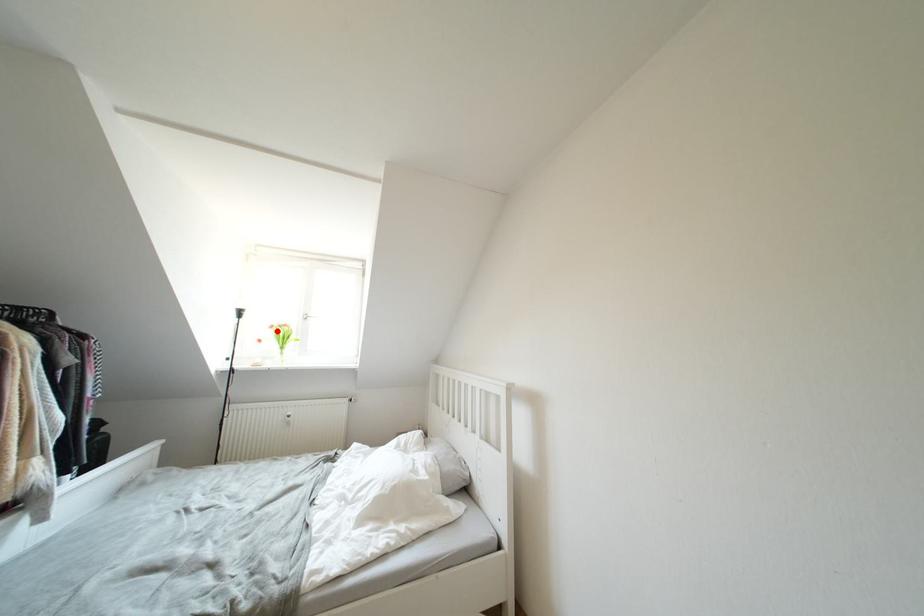
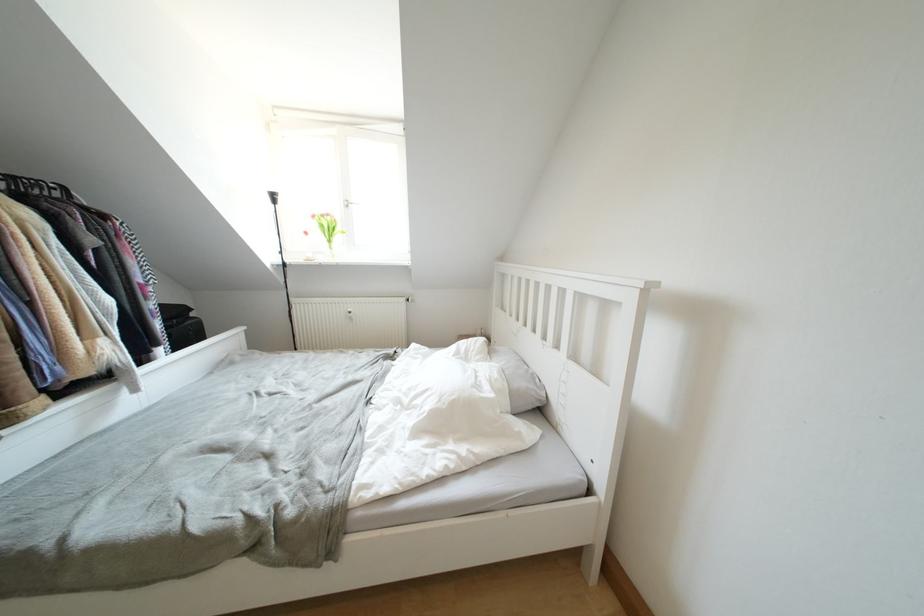
Where in the second image is the point corresponding to the highlighted location from the first image?

(319, 220)